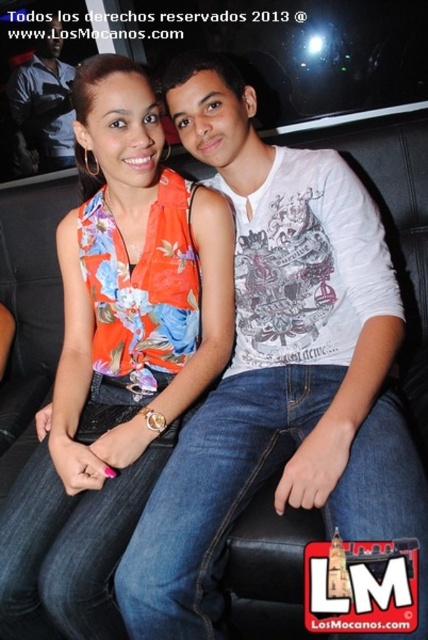
In the scene shown: Who is positioned more to the left, white printed t-shirt at center or matte black shirt at upper left?

matte black shirt at upper left

At what (x,y) coordinates should I click in order to perform the action: click on white printed t-shirt at center. Please return your answer as a coordinate pair (x, y). The height and width of the screenshot is (640, 428). Looking at the image, I should click on 279,371.

Between white printed t-shirt at center and floral fabric top at center, which one is positioned lower?

floral fabric top at center

Is white printed t-shirt at center positioned at the back of floral fabric top at center?

No, white printed t-shirt at center is closer to the viewer.

This screenshot has height=640, width=428. Identify the location of white printed t-shirt at center. (279, 371).

Consider the image. Which of these two, floral fabric top at center or matte black shirt at upper left, stands shorter?

With less height is matte black shirt at upper left.

Does floral fabric top at center appear over matte black shirt at upper left?

Actually, floral fabric top at center is below matte black shirt at upper left.

Does point (65, 464) come closer to viewer compared to point (45, 58)?

Yes, it is in front of point (45, 58).

At what (x,y) coordinates should I click in order to perform the action: click on floral fabric top at center. Please return your answer as a coordinate pair (x, y). Image resolution: width=428 pixels, height=640 pixels. Looking at the image, I should click on (115, 360).